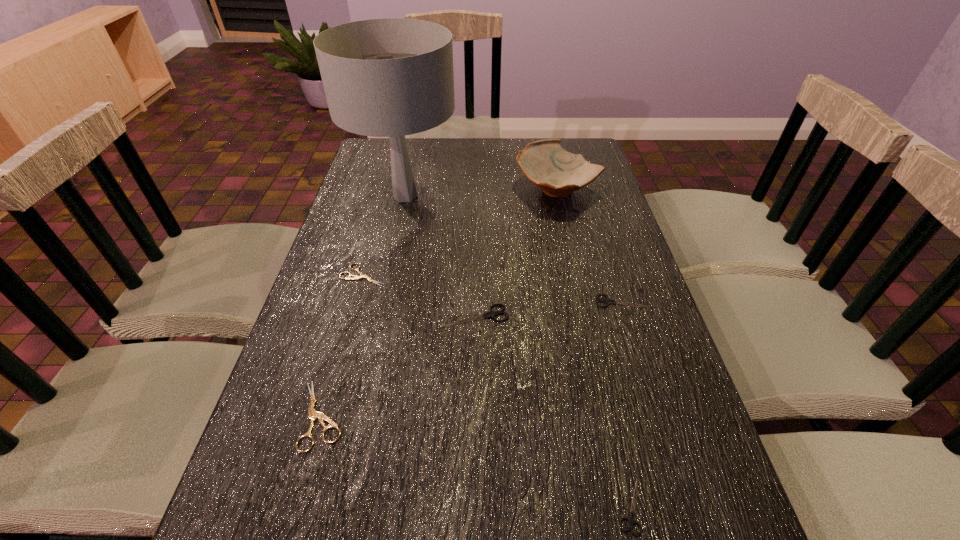
This screenshot has height=540, width=960. Identify the location of the tallest object. (390, 77).

Where is `brown lampshade`? brown lampshade is located at coordinates (390, 77).

Locate an element on the screen. pottery is located at coordinates (558, 173).

Find the location of a particular element. Image resolution: width=960 pixels, height=540 pixels. the biggest black shears is located at coordinates (492, 314).

Where is `the tallest shears`? The height and width of the screenshot is (540, 960). the tallest shears is located at coordinates (492, 314).

The width and height of the screenshot is (960, 540). I want to click on the rightmost black shears, so click(607, 301).

Find the location of a particular element. This screenshot has width=960, height=540. the second biggest black shears is located at coordinates (607, 301).

Identify the location of the second nearest shears. (312, 413).

Where is `the bigger beige shears`? The image size is (960, 540). the bigger beige shears is located at coordinates (312, 413).

The height and width of the screenshot is (540, 960). In order to click on the fifth nearest object in this screenshot , I will do `click(355, 277)`.